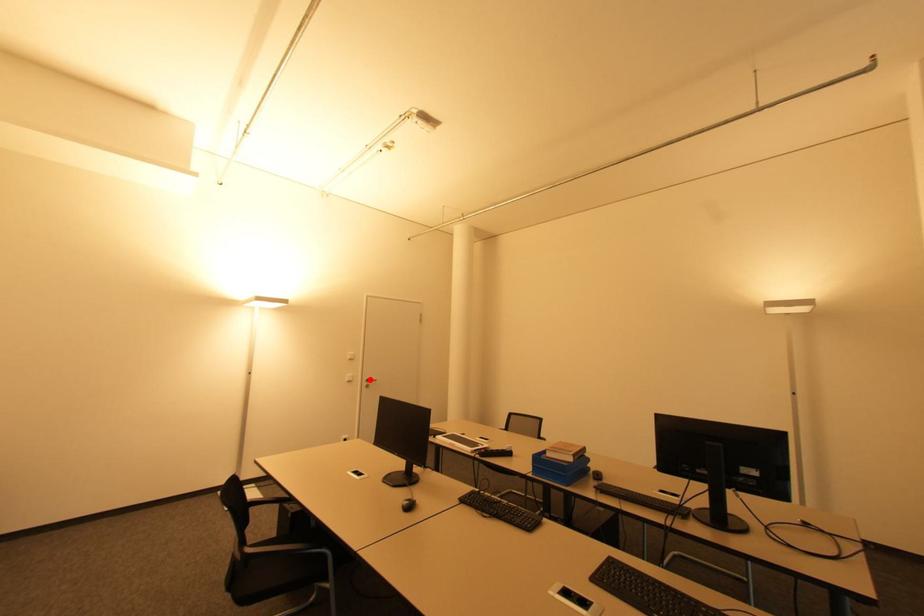
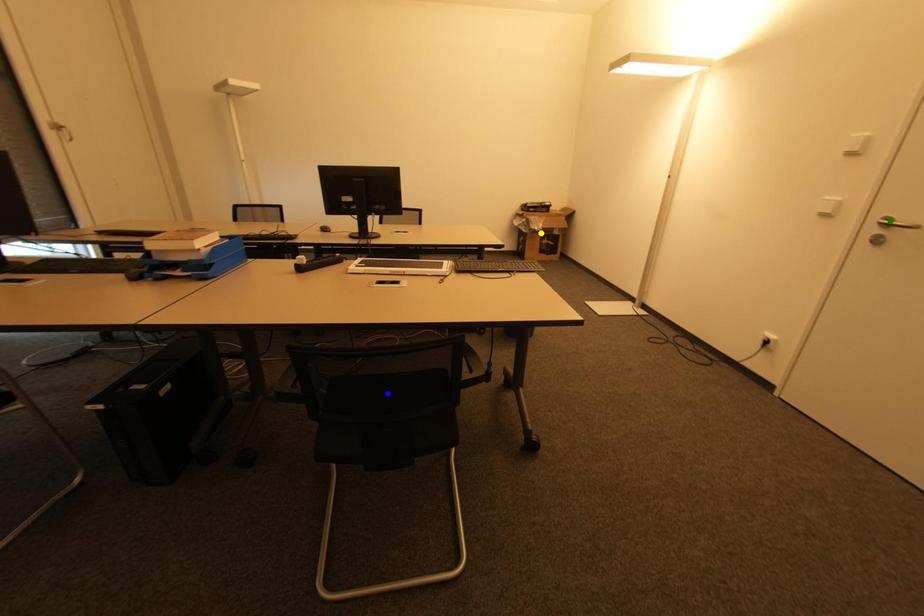
Question: I am providing you with two images of the same scene from different viewpoints. A red point is marked on the first image. You are given multiple points on the second image. Which point in image 2 represents the same 3d spot as the red point in image 1?

Choices:
 (A) green point
 (B) yellow point
 (C) blue point

Answer: (A)